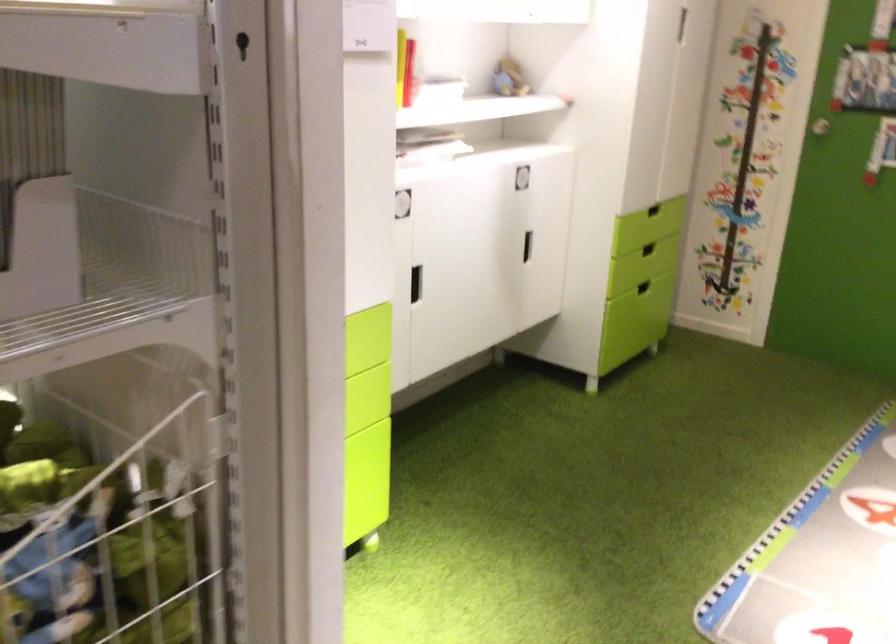
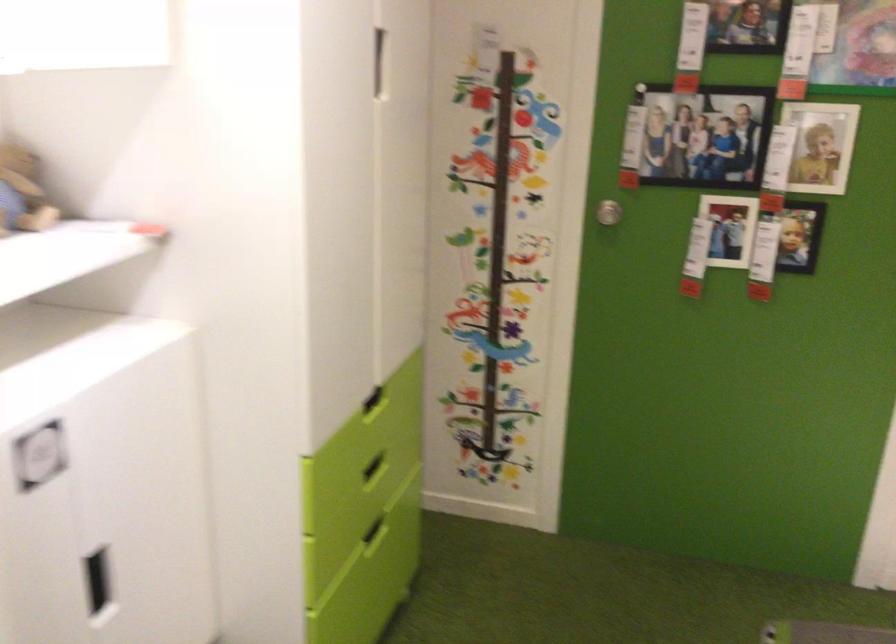
The point at (509, 77) is marked in the first image. Where is the corresponding point in the second image?

(22, 192)